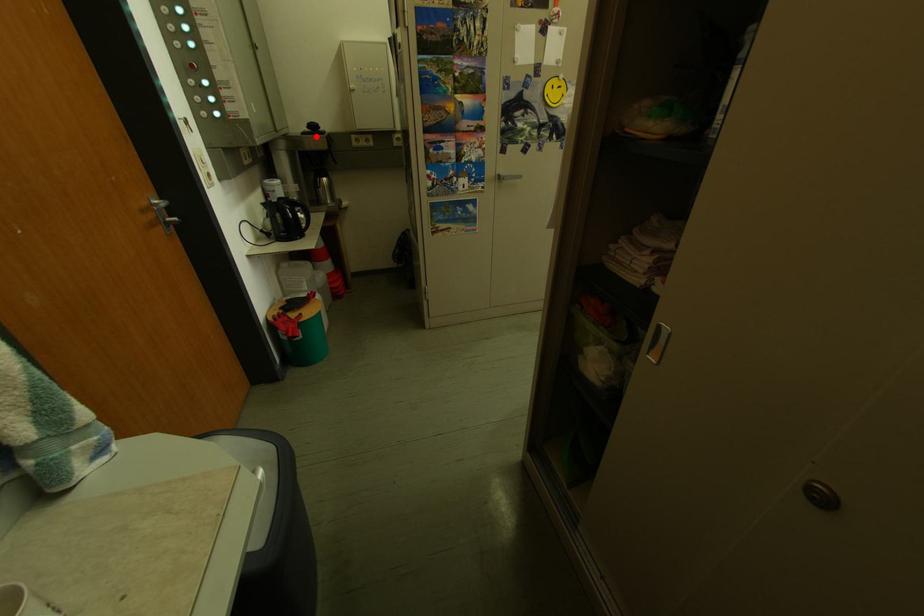
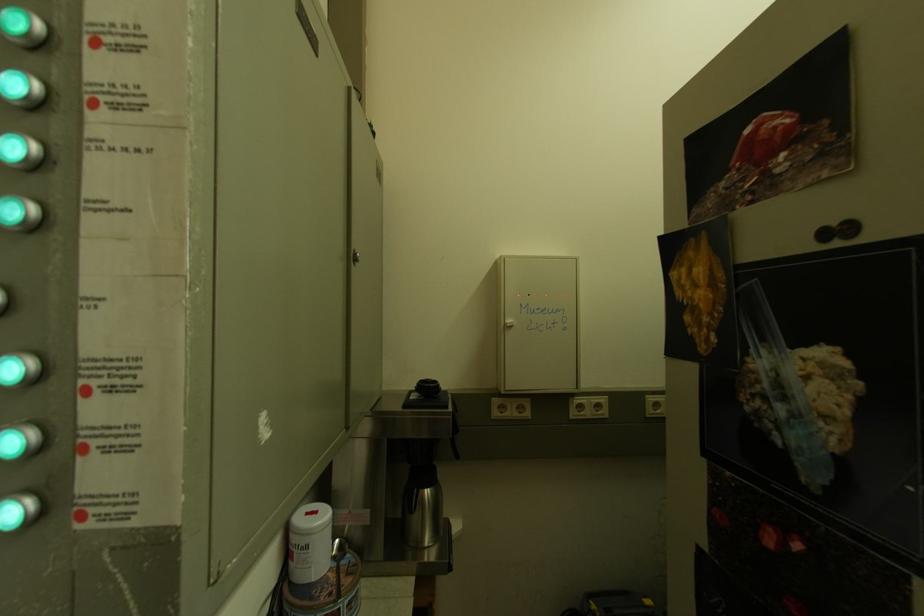
Locate, in the second image, the point that corresponds to the highlighted location in the first image.

(420, 408)